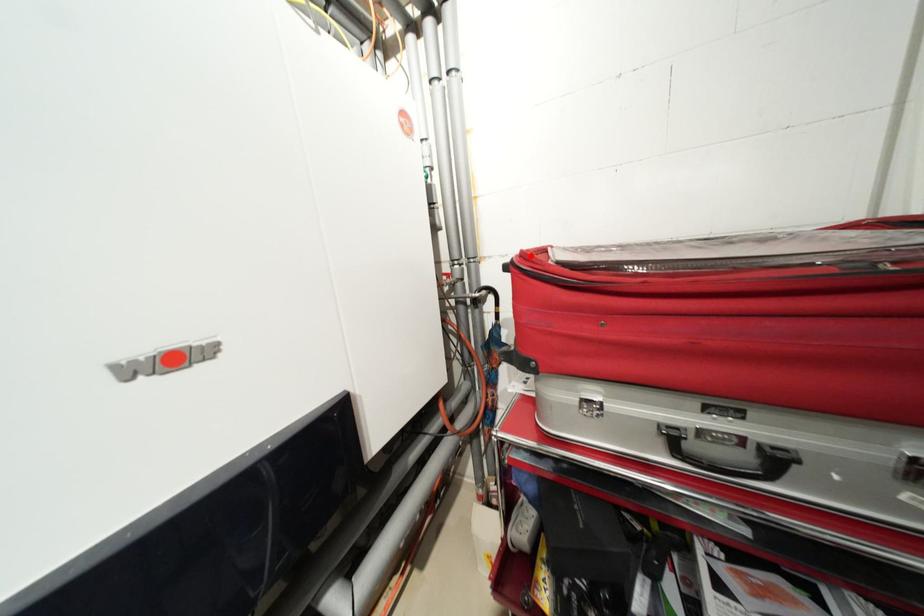
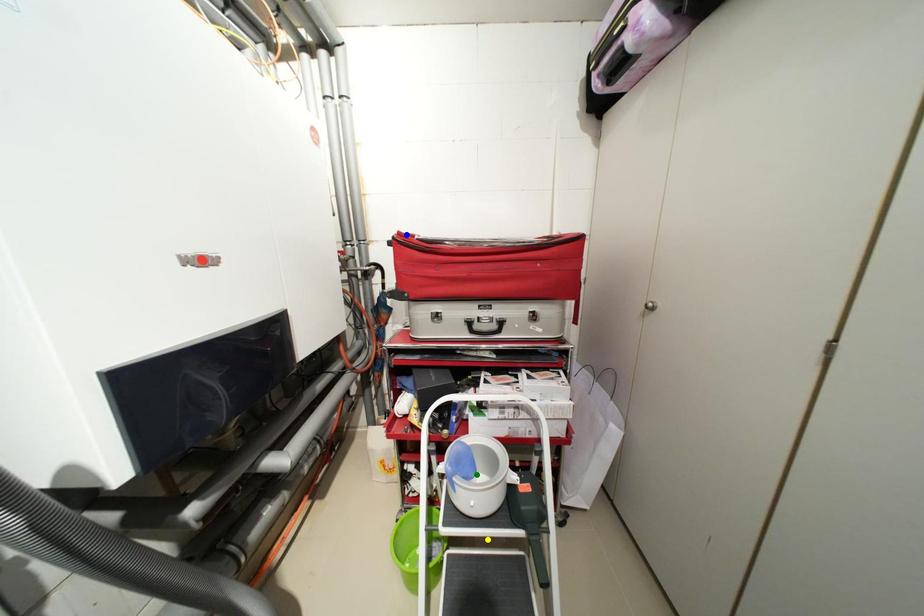
Question: I am providing you with two images of the same scene from different viewpoints. A red point is marked on the first image. You are given multiple points on the second image. Which mark in image 2 goes with the point in image 1?

Choices:
 (A) yellow point
 (B) green point
 (C) blue point

Answer: (C)